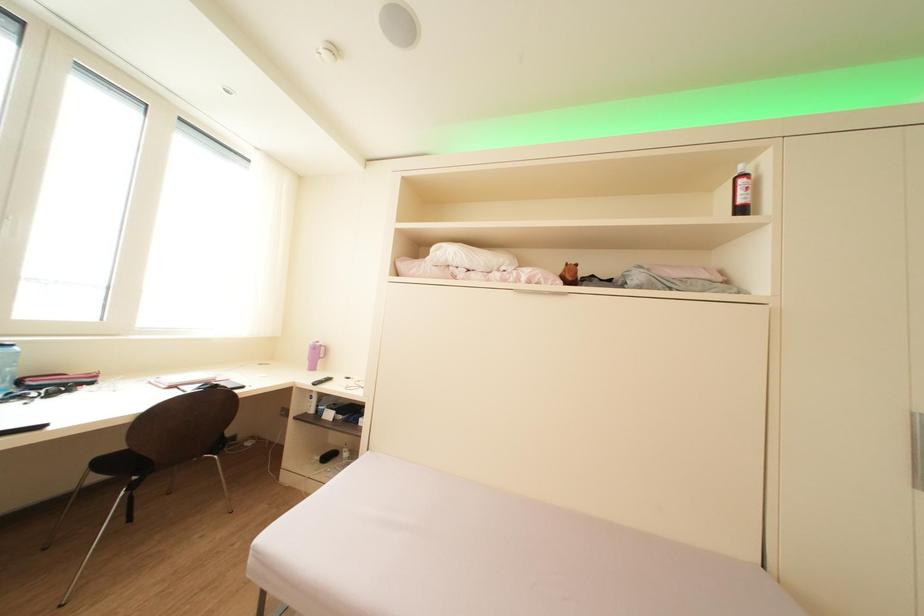
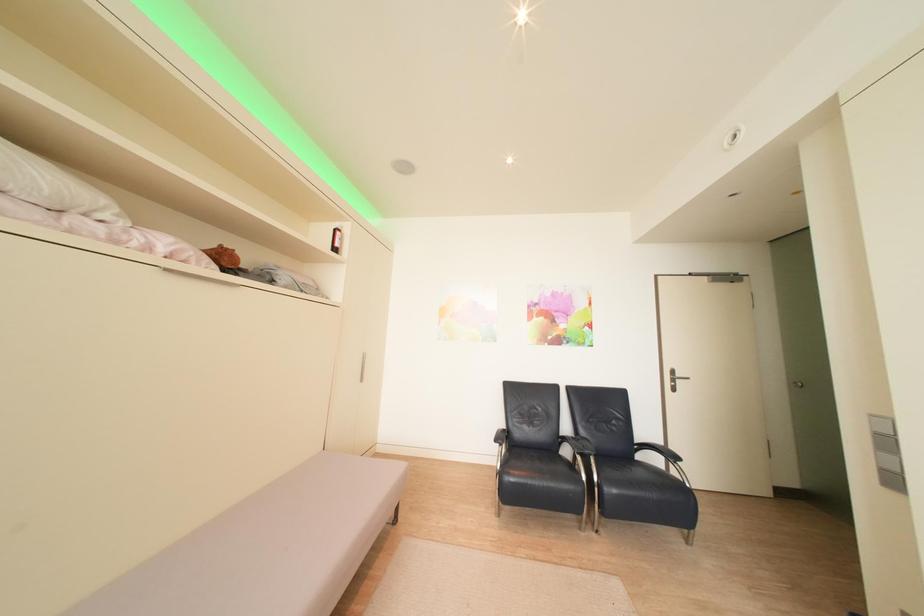
Question: How did the camera likely rotate?

Choices:
 (A) Left
 (B) Right
 (C) Up
 (D) Down

Answer: (B)